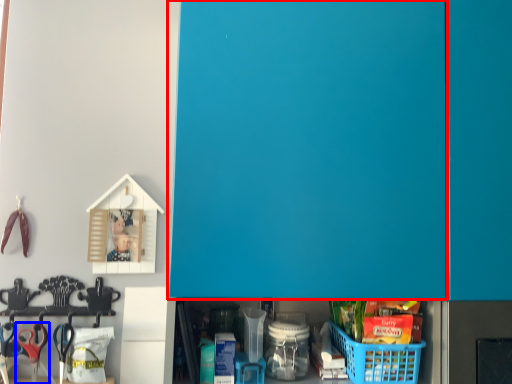
Question: Among these objects, which one is farthest to the camera, door (highlighted by a red box) or scissors (highlighted by a blue box)?

Choices:
 (A) door
 (B) scissors

Answer: (B)